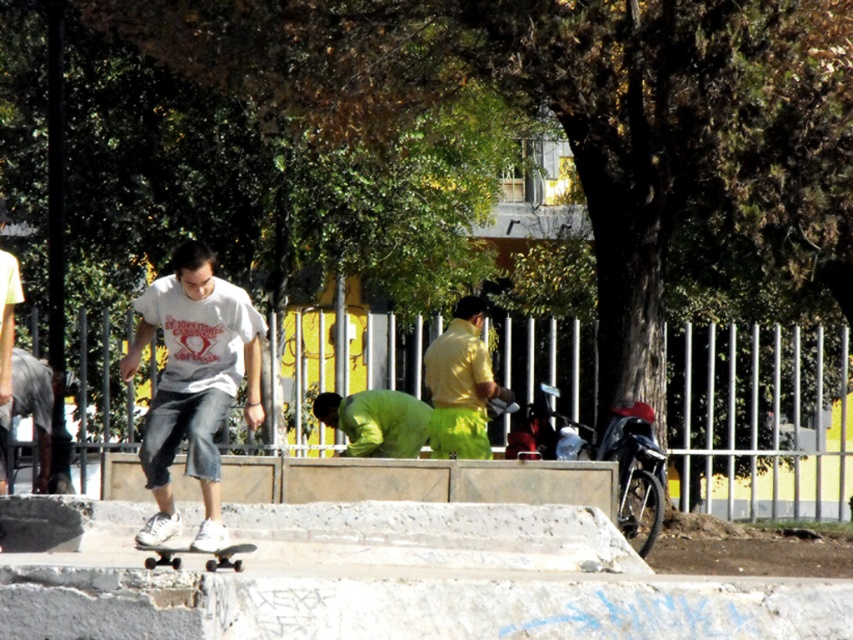
Is point (160, 461) positioned behind point (415, 417)?

No.

Who is more forward, [207,340] or [341,413]?

Point [207,340] is more forward.

Find the location of a particular element. The width and height of the screenshot is (853, 640). white matte t-shirt at center is located at coordinates (193, 384).

Can you confirm if yellow-green shirt at center is wider than green matte shirt at center?

Incorrect, yellow-green shirt at center's width does not surpass green matte shirt at center's.

Based on the photo, who is taller, yellow-green shirt at center or green matte shirt at center?

yellow-green shirt at center

Is point (451, 372) closer to camera compared to point (422, 435)?

Yes, it is in front of point (422, 435).

Locate an element on the screen. This screenshot has height=640, width=853. yellow-green shirt at center is located at coordinates (461, 385).

Is point (213, 531) in front of point (482, 390)?

That is True.

Can you confirm if white matte t-shirt at center is bigger than yellow-green shirt at center?

Yes.

Is point (183, 282) closer to viewer compared to point (445, 355)?

That is True.

In order to click on white matte t-shirt at center in this screenshot , I will do `click(193, 384)`.